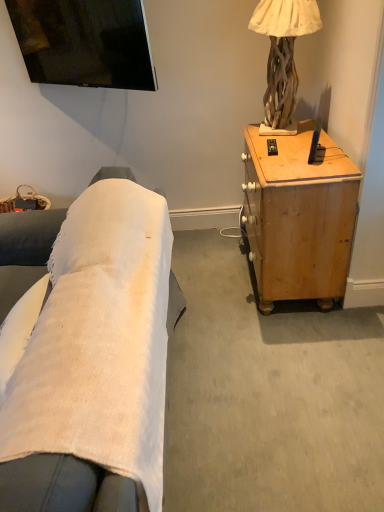
The width and height of the screenshot is (384, 512). I want to click on empty space that is in between black plastic remote control at upper right and natural wood lamp at upper right, so click(x=279, y=148).